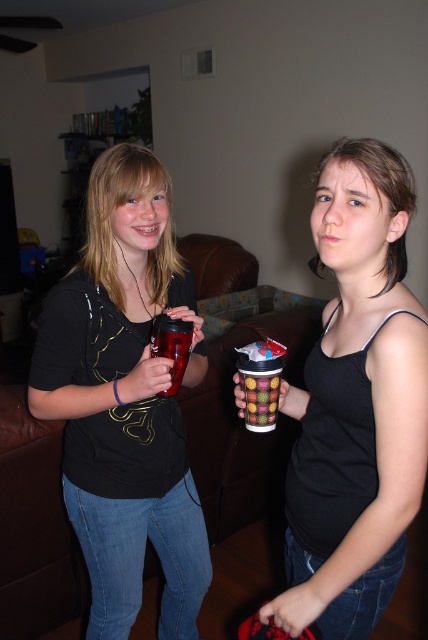
Question: Among these points, which one is nearest to the camera?

Choices:
 (A) (x=250, y=369)
 (B) (x=362, y=168)
 (C) (x=56, y=356)

Answer: (B)

Question: Where is matte black tank top at center located in relation to multicolored plastic cup at center in the image?

Choices:
 (A) left
 (B) right

Answer: (B)

Question: Which object appears farthest from the camera in this image?

Choices:
 (A) matte plastic cup at center
 (B) multicolored plastic cup at center
 (C) matte black tank top at center

Answer: (A)

Question: Can you confirm if matte plastic cup at center is bigger than multicolored plastic cup at center?

Choices:
 (A) yes
 (B) no

Answer: (A)

Question: Which of the following is the closest to the observer?

Choices:
 (A) (359, 454)
 (B) (192, 621)

Answer: (A)

Question: Can you confirm if matte plastic cup at center is smaller than multicolored plastic cup at center?

Choices:
 (A) no
 (B) yes

Answer: (A)